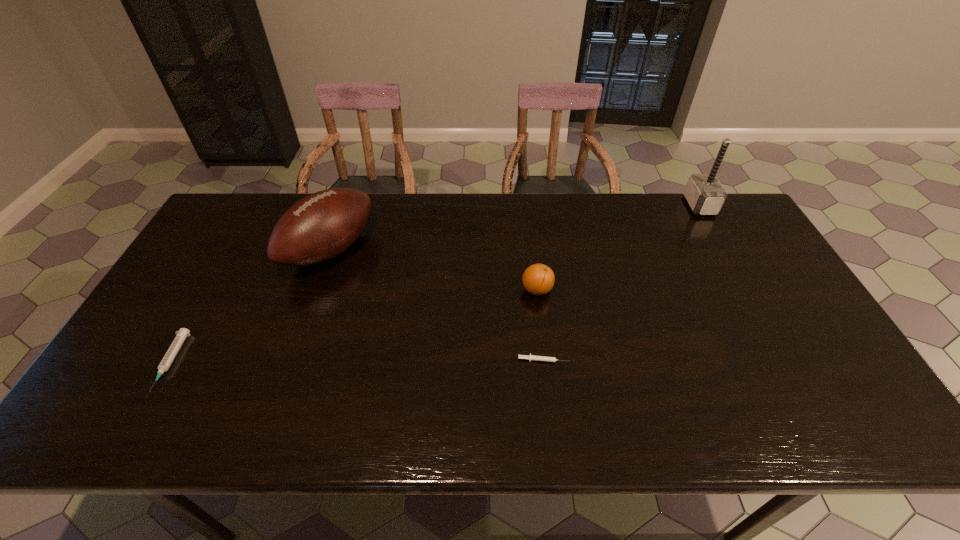
Identify the location of free space between the right syringe and the orange. Image resolution: width=960 pixels, height=540 pixels. (540, 325).

Locate an element on the screen. This screenshot has height=540, width=960. vacant space that's between the third shortest object and the fourth object from right to left is located at coordinates (434, 270).

Locate an element on the screen. The image size is (960, 540). free space between the orange and the shorter syringe is located at coordinates (540, 325).

I want to click on vacant area between the left syringe and the orange, so click(354, 326).

Where is `vacant region between the fourth shortest object and the third shortest object`? This screenshot has width=960, height=540. vacant region between the fourth shortest object and the third shortest object is located at coordinates (434, 270).

At what (x,y) coordinates should I click in order to perform the action: click on empty space that is in between the fourth tallest object and the rightmost object. Please return your answer as a coordinate pair (x, y). The image size is (960, 540). Looking at the image, I should click on (435, 284).

Find the location of a particular element. Image resolution: width=960 pixels, height=540 pixels. the second closest object relative to the right syringe is located at coordinates (322, 225).

Where is `object that is the closest to the left syringe`? The height and width of the screenshot is (540, 960). object that is the closest to the left syringe is located at coordinates (322, 225).

Find the location of a particular element. The height and width of the screenshot is (540, 960). free spot that satisfies the following two spatial constraints: 1. for striking with the head of the hammer; 2. on the front side of the second tallest object is located at coordinates (725, 250).

Identify the location of vacant space that satisfies the following two spatial constraints: 1. on the front side of the second tallest object; 2. on the left side of the third shortest object. This screenshot has height=540, width=960. (316, 290).